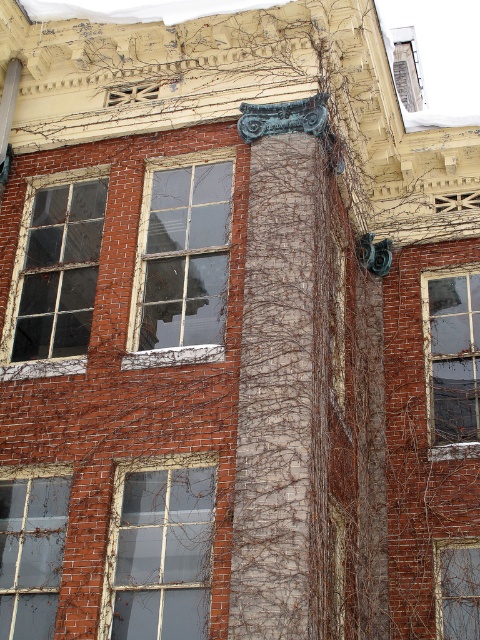
Question: Is clear glass window at lower left further to camera compared to transparent glass window at lower right?

Choices:
 (A) no
 (B) yes

Answer: (A)

Question: Is clear glass window at center to the right of transparent glass window at right from the viewer's perspective?

Choices:
 (A) yes
 (B) no

Answer: (B)

Question: Does transparent glass window at center have a greater width compared to clear glass window at lower left?

Choices:
 (A) no
 (B) yes

Answer: (B)

Question: Estimate the real-world distances between objects in this image. Which object is farther from the clear glass window at lower left?

Choices:
 (A) transparent glass window at center
 (B) transparent glass window at right

Answer: (B)

Question: Which of these objects is positioned closest to the transparent glass window at right?

Choices:
 (A) transparent glass window at lower right
 (B) transparent glass window at center
 (C) clear glass window at center
 (D) transparent glass window at left

Answer: (A)

Question: Which object appears farthest from the camera in this image?

Choices:
 (A) clear glass window at lower left
 (B) clear glass window at center
 (C) transparent glass window at right

Answer: (C)